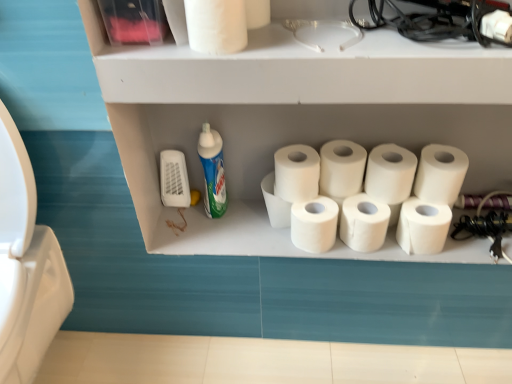
The height and width of the screenshot is (384, 512). What do you see at coordinates (216, 25) in the screenshot?
I see `white matte toilet paper at upper center, the 11th toilet paper in the right-to-left sequence` at bounding box center [216, 25].

Find the location of a particular element. The width and height of the screenshot is (512, 384). white matte toilet paper at center, the eighth toilet paper from the right is located at coordinates (296, 173).

The image size is (512, 384). What do you see at coordinates (257, 13) in the screenshot?
I see `white matte toilet paper at upper center, acting as the tenth toilet paper starting from the right` at bounding box center [257, 13].

This screenshot has height=384, width=512. What do you see at coordinates (440, 174) in the screenshot? I see `white matte toilet paper at right, which is the first toilet paper from right to left` at bounding box center [440, 174].

The image size is (512, 384). Describe the element at coordinates (212, 171) in the screenshot. I see `blue glossy bottle at center-left` at that location.

What are the coordinates of `white matte toilet paper at upper center, the 11th toilet paper in the right-to-left sequence` in the screenshot? It's located at (216, 25).

Is white matte toilet paper at center, positioned as the 3th toilet paper in left-to-right order, with white matte toilet paper at upper center, acting as the tenth toilet paper starting from the right?

No, white matte toilet paper at center, positioned as the 3th toilet paper in left-to-right order, is not beside white matte toilet paper at upper center, acting as the tenth toilet paper starting from the right.

Considering the relative positions of white matte toilet paper at center, positioned as the 3th toilet paper in left-to-right order, and white matte toilet paper at upper center, the 2th toilet paper positioned from the left, in the image provided, is white matte toilet paper at center, positioned as the 3th toilet paper in left-to-right order, to the right of white matte toilet paper at upper center, the 2th toilet paper positioned from the left, from the viewer's perspective?

Correct, you'll find white matte toilet paper at center, positioned as the 3th toilet paper in left-to-right order, to the right of white matte toilet paper at upper center, the 2th toilet paper positioned from the left.

Starting from the white matte toilet paper at upper center, acting as the tenth toilet paper starting from the right, which toilet paper is the 1st one to the right? Please provide its 2D coordinates.

[(275, 204)]

Considering the relative sizes of white matte toilet paper at center, placed as the 9th toilet paper when sorted from right to left, and white matte toilet paper at upper center, acting as the tenth toilet paper starting from the right, in the image provided, is white matte toilet paper at center, placed as the 9th toilet paper when sorted from right to left, wider than white matte toilet paper at upper center, acting as the tenth toilet paper starting from the right,?

Indeed, white matte toilet paper at center, placed as the 9th toilet paper when sorted from right to left, has a greater width compared to white matte toilet paper at upper center, acting as the tenth toilet paper starting from the right.

This screenshot has height=384, width=512. In order to click on the 6th toilet paper located above the blue glossy bottle at center-left (from a real-world perspective) in this screenshot , I will do `click(257, 13)`.

Is white matte toilet paper at upper center, acting as the tenth toilet paper starting from the right, positioned beyond the bounds of blue glossy bottle at center-left?

white matte toilet paper at upper center, acting as the tenth toilet paper starting from the right, is positioned outside blue glossy bottle at center-left.

Is there a large distance between white matte toilet paper at upper center, acting as the tenth toilet paper starting from the right, and blue glossy bottle at center-left?

No.

From a real-world perspective, is white matte toilet paper at upper center, the 11th toilet paper in the right-to-left sequence, under white matte toilet paper at center, which is counted as the seventh toilet paper, starting from the right?

No, from a real-world perspective, white matte toilet paper at upper center, the 11th toilet paper in the right-to-left sequence, is not under white matte toilet paper at center, which is counted as the seventh toilet paper, starting from the right.

This screenshot has height=384, width=512. Find the location of `the 4th toilet paper to the right of the white matte toilet paper at upper center, placed as the 1th toilet paper when sorted from left to right, starting your count from the anchor`. the 4th toilet paper to the right of the white matte toilet paper at upper center, placed as the 1th toilet paper when sorted from left to right, starting your count from the anchor is located at coordinates (314, 224).

Is white matte toilet paper at upper center, the 11th toilet paper in the right-to-left sequence, facing towards white matte toilet paper at center, which is counted as the seventh toilet paper, starting from the right?

No, white matte toilet paper at upper center, the 11th toilet paper in the right-to-left sequence, is not facing towards white matte toilet paper at center, which is counted as the seventh toilet paper, starting from the right.

Between white matte toilet paper at upper center, the 11th toilet paper in the right-to-left sequence, and white matte toilet paper at center, which is counted as the seventh toilet paper, starting from the right, which one is positioned behind?

white matte toilet paper at center, which is counted as the seventh toilet paper, starting from the right, is further from the camera.

Which is closer, (268, 179) or (402, 226)?

Point (268, 179) appears to be farther away from the viewer than point (402, 226).

How much distance is there between white matte toilet paper at center, positioned as the 3th toilet paper in left-to-right order, and white matte toilet paper at right, the 9th toilet paper in the left-to-right sequence?

white matte toilet paper at center, positioned as the 3th toilet paper in left-to-right order, and white matte toilet paper at right, the 9th toilet paper in the left-to-right sequence, are 11.44 inches apart from each other.

Is white matte toilet paper at center, positioned as the 3th toilet paper in left-to-right order, to the left or to the right of white matte toilet paper at right, the third toilet paper viewed from the right, in the image?

white matte toilet paper at center, positioned as the 3th toilet paper in left-to-right order, is positioned on white matte toilet paper at right, the third toilet paper viewed from the right,'s left side.

Would you consider blue glossy bottle at center-left to be distant from white matte toilet paper at center, which is counted as the seventh toilet paper, starting from the right?

They are positioned close to each other.

Between blue glossy bottle at center-left and white matte toilet paper at center, which is counted as the fifth toilet paper, starting from the left, which one has more height?

blue glossy bottle at center-left is taller.

Visually, is blue glossy bottle at center-left positioned to the left or to the right of white matte toilet paper at center, which is counted as the fifth toilet paper, starting from the left?

Clearly, blue glossy bottle at center-left is on the left of white matte toilet paper at center, which is counted as the fifth toilet paper, starting from the left, in the image.

Would you say blue glossy bottle at center-left is inside or outside white matte toilet paper at center, which is counted as the seventh toilet paper, starting from the right?

blue glossy bottle at center-left lies outside white matte toilet paper at center, which is counted as the seventh toilet paper, starting from the right.

Is white matte toilet paper at center, which is counted as the seventh toilet paper, starting from the right, outside of white matte toilet paper at upper center, the 2th toilet paper positioned from the left?

Yes, white matte toilet paper at center, which is counted as the seventh toilet paper, starting from the right, is located beyond the bounds of white matte toilet paper at upper center, the 2th toilet paper positioned from the left.

Does white matte toilet paper at center, which is counted as the seventh toilet paper, starting from the right, appear on the right side of white matte toilet paper at upper center, acting as the tenth toilet paper starting from the right?

Correct, you'll find white matte toilet paper at center, which is counted as the seventh toilet paper, starting from the right, to the right of white matte toilet paper at upper center, acting as the tenth toilet paper starting from the right.

From the image's perspective, is white matte toilet paper at center, which is counted as the seventh toilet paper, starting from the right, located above white matte toilet paper at upper center, acting as the tenth toilet paper starting from the right?

→ No.

Who is shorter, white matte toilet paper at center, which ranks as the 6th toilet paper in left-to-right order, or white matte toilet paper at center, which is counted as the fifth toilet paper, starting from the left?

white matte toilet paper at center, which is counted as the fifth toilet paper, starting from the left, is shorter.

Is white matte toilet paper at center, which is counted as the fifth toilet paper, starting from the left, surrounded by white matte toilet paper at center, which ranks as the 6th toilet paper in left-to-right order?

No, white matte toilet paper at center, which is counted as the fifth toilet paper, starting from the left, is not surrounded by white matte toilet paper at center, which ranks as the 6th toilet paper in left-to-right order.

Are white matte toilet paper at center, which ranks as the 6th toilet paper in left-to-right order, and white matte toilet paper at center, which is counted as the fifth toilet paper, starting from the left, beside each other?

Indeed, white matte toilet paper at center, which ranks as the 6th toilet paper in left-to-right order, and white matte toilet paper at center, which is counted as the fifth toilet paper, starting from the left, are beside each other and touching.

Image resolution: width=512 pixels, height=384 pixels. Identify the location of the 7th toilet paper below the white matte toilet paper at center, which ranks as the 6th toilet paper in left-to-right order (from the image's perspective). (314, 224).

The image size is (512, 384). There is a white matte toilet paper at center, positioned as the 3th toilet paper in left-to-right order. Find the location of `the 7th toilet paper above it (from the image's perspective)`. the 7th toilet paper above it (from the image's perspective) is located at coordinates (257, 13).

Locate an element on the screen. This screenshot has width=512, height=384. the 2nd toilet paper to the right of the blue glossy bottle at center-left, counting from the anchor's position is located at coordinates (257, 13).

Which object lies nearer to the anchor point white matte toilet paper at center, which is counted as the fifth toilet paper, starting from the left, white matte toilet paper at center, the seventh toilet paper from the left, or white matte toilet paper at upper center, placed as the 1th toilet paper when sorted from left to right?

Among the two, white matte toilet paper at center, the seventh toilet paper from the left, is located nearer to white matte toilet paper at center, which is counted as the fifth toilet paper, starting from the left.

Estimate the real-world distances between objects in this image. Which object is closer to white matte toilet paper at right, positioned as the 11th toilet paper in left-to-right order, white matte toilet paper at center, the sixth toilet paper viewed from the right, or white matte toilet paper at center, which appears as the 5th toilet paper when viewed from the right?

The object closer to white matte toilet paper at right, positioned as the 11th toilet paper in left-to-right order, is white matte toilet paper at center, which appears as the 5th toilet paper when viewed from the right.

Which object lies further to the anchor point white matte toilet paper at center, which is counted as the fifth toilet paper, starting from the left, white matte toilet paper at center, which ranks as the 6th toilet paper in left-to-right order, or white matte toilet paper at right, which is the first toilet paper from right to left?

white matte toilet paper at right, which is the first toilet paper from right to left, lies further to white matte toilet paper at center, which is counted as the fifth toilet paper, starting from the left, than the other object.

Which object lies nearer to the anchor point white matte toilet paper at right, positioned as the 11th toilet paper in left-to-right order, white matte toilet paper at upper center, placed as the 1th toilet paper when sorted from left to right, or white matte toilet paper at center, which is counted as the fifth toilet paper, starting from the left?

white matte toilet paper at center, which is counted as the fifth toilet paper, starting from the left, is positioned closer to the anchor white matte toilet paper at right, positioned as the 11th toilet paper in left-to-right order.

When comparing their distances from white matte shelf at upper center, does white matte toilet paper at upper right, placed as the 10th toilet paper when sorted from left to right, or white matte toilet paper at upper center, the 11th toilet paper in the right-to-left sequence, seem further?

The object further to white matte shelf at upper center is white matte toilet paper at upper right, placed as the 10th toilet paper when sorted from left to right.

Considering their positions, is white matte toilet paper at center, placed as the 9th toilet paper when sorted from right to left, positioned further to white matte toilet paper at center, which is counted as the fourth toilet paper, starting from the right, than white matte shelf at upper center?

Among the two, white matte shelf at upper center is located further to white matte toilet paper at center, which is counted as the fourth toilet paper, starting from the right.

Based on their spatial positions, is white matte toilet paper at center, which appears as the 5th toilet paper when viewed from the right, or blue glossy bottle at center-left further from white matte toilet paper at right, positioned as the 11th toilet paper in left-to-right order?

Based on the image, blue glossy bottle at center-left appears to be further to white matte toilet paper at right, positioned as the 11th toilet paper in left-to-right order.

Looking at the image, which one is located closer to white matte toilet paper at center, which appears as the 5th toilet paper when viewed from the right, white matte shelf at upper center or white matte toilet paper at upper center, placed as the 1th toilet paper when sorted from left to right?

Based on the image, white matte shelf at upper center appears to be nearer to white matte toilet paper at center, which appears as the 5th toilet paper when viewed from the right.

In order to click on cleaning product between white matte toilet paper at upper center, acting as the tenth toilet paper starting from the right, and white matte toilet paper at center, positioned as the 3th toilet paper in left-to-right order, from top to bottom in this screenshot , I will do `click(212, 171)`.

This screenshot has width=512, height=384. Find the location of `shelf situated between white matte toilet paper at center, positioned as the 3th toilet paper in left-to-right order, and white matte toilet paper at right, positioned as the 11th toilet paper in left-to-right order, from left to right`. shelf situated between white matte toilet paper at center, positioned as the 3th toilet paper in left-to-right order, and white matte toilet paper at right, positioned as the 11th toilet paper in left-to-right order, from left to right is located at coordinates 300,71.

This screenshot has height=384, width=512. In order to click on cleaning product between white matte toilet paper at upper center, the 11th toilet paper in the right-to-left sequence, and white matte toilet paper at center, which is counted as the fifth toilet paper, starting from the left, from top to bottom in this screenshot , I will do `click(212, 171)`.

In order to click on shelf located between blue glossy bottle at center-left and white matte toilet paper at upper right, which is the 2th toilet paper from right to left, in the left-right direction in this screenshot , I will do `click(300, 71)`.